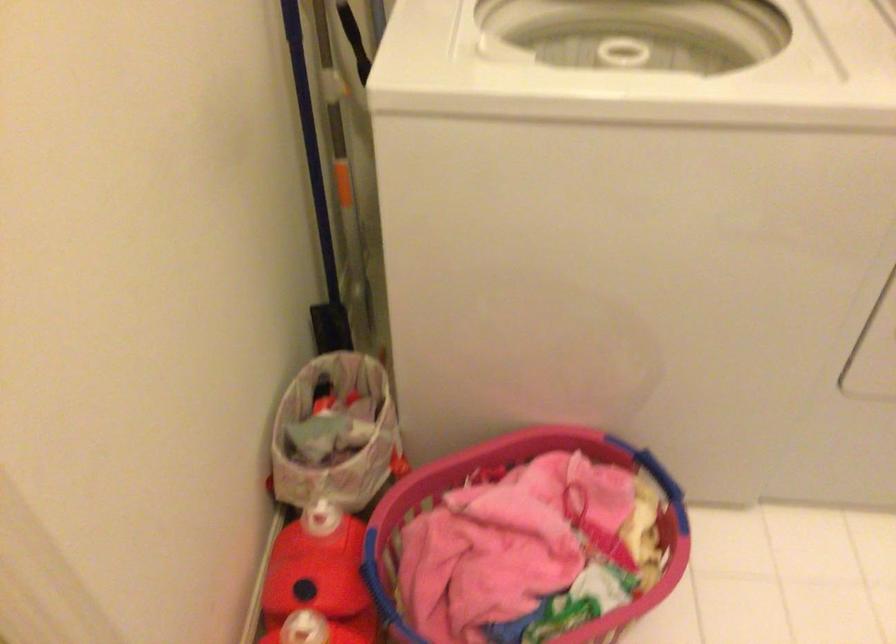
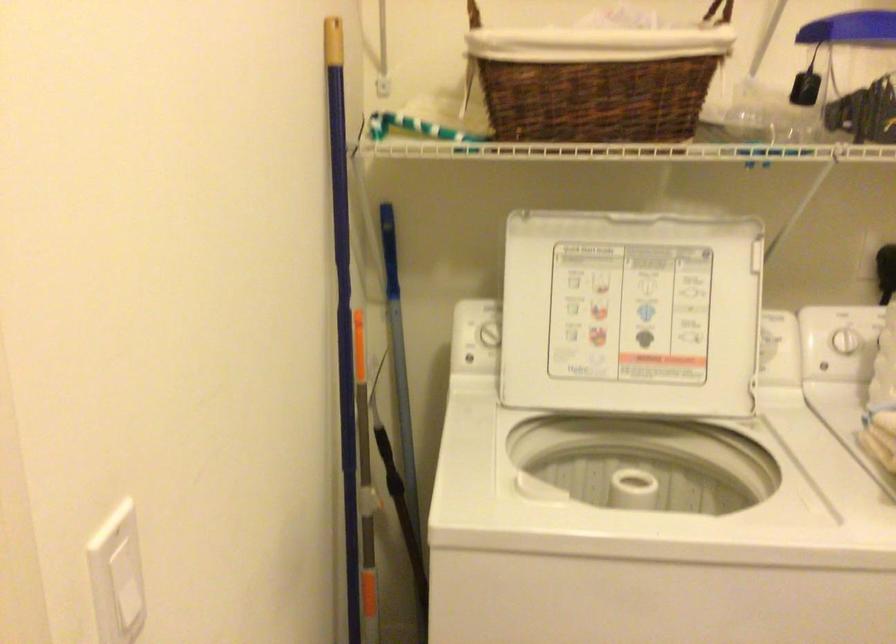
In a continuous first-person perspective shot, in which direction is the camera moving?

The cameraman walked toward left, backward.